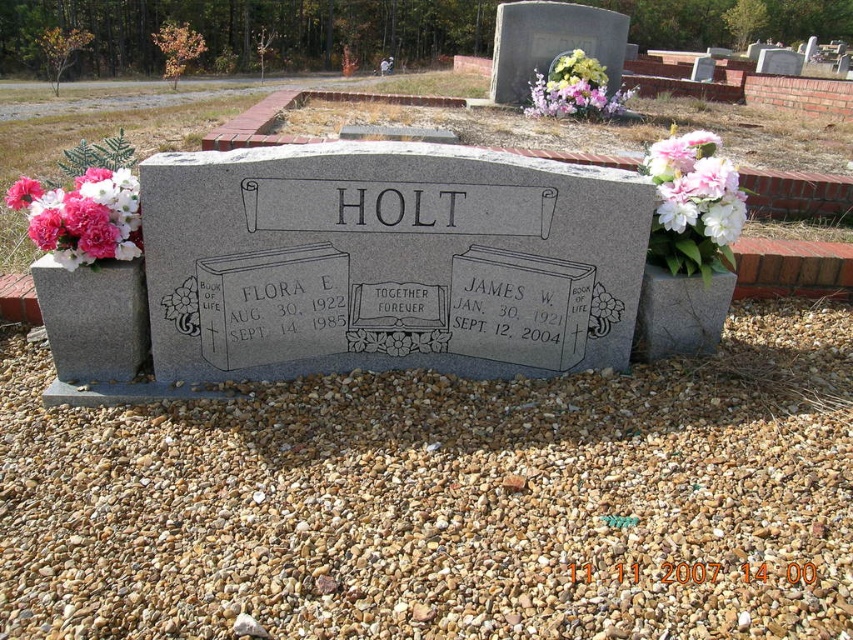
Question: Does white matte flowers at upper right have a smaller size compared to black stone text at center?

Choices:
 (A) no
 (B) yes

Answer: (A)

Question: Which object is positioned closest to the granite gravestone at center?

Choices:
 (A) black stone text at center
 (B) pink floral bouquet at upper center
 (C) pink silk carnation at left
 (D) white matte flowers at upper right

Answer: (C)

Question: Which object is positioned closest to the black stone text at center?

Choices:
 (A) granite gravestone at center
 (B) pink floral bouquet at upper center
 (C) white matte flowers at upper right

Answer: (A)

Question: Does granite gravestone at center appear on the left side of pink silk carnation at left?

Choices:
 (A) no
 (B) yes

Answer: (A)

Question: Can you confirm if granite gravestone at center is positioned above white matte flowers at upper right?

Choices:
 (A) yes
 (B) no

Answer: (B)

Question: Among these objects, which one is nearest to the camera?

Choices:
 (A) white matte flowers at upper right
 (B) granite gravestone at center
 (C) pink floral bouquet at upper center
 (D) pink silk carnation at left

Answer: (D)